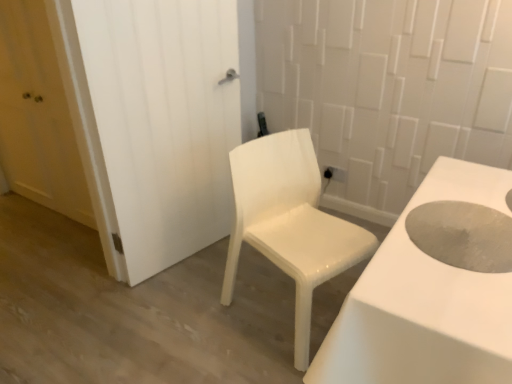
Question: Is matte white door at left, which ranks as the 1th door in left-to-right order, not inside white glossy chair at center?

Choices:
 (A) no
 (B) yes

Answer: (B)

Question: Would you consider matte white door at left, which ranks as the 1th door in left-to-right order, to be distant from white glossy chair at center?

Choices:
 (A) yes
 (B) no

Answer: (A)

Question: Can you confirm if matte white door at left, which ranks as the 1th door in left-to-right order, is wider than white glossy chair at center?

Choices:
 (A) yes
 (B) no

Answer: (B)

Question: Is white glossy chair at center at the back of matte white door at left, which ranks as the 1th door in left-to-right order?

Choices:
 (A) no
 (B) yes

Answer: (A)

Question: Considering the relative sizes of matte white door at left, which ranks as the 2th door in right-to-left order, and white glossy chair at center in the image provided, is matte white door at left, which ranks as the 2th door in right-to-left order, taller than white glossy chair at center?

Choices:
 (A) yes
 (B) no

Answer: (A)

Question: In the image, is gray matte hole at center right positioned in front of or behind white glossy chair at center?

Choices:
 (A) front
 (B) behind

Answer: (A)

Question: Is gray matte hole at center right wider or thinner than white glossy chair at center?

Choices:
 (A) wide
 (B) thin

Answer: (B)

Question: From a real-world perspective, is gray matte hole at center right above or below white glossy chair at center?

Choices:
 (A) below
 (B) above

Answer: (B)

Question: From the image's perspective, is gray matte hole at center right positioned above or below white glossy chair at center?

Choices:
 (A) above
 (B) below

Answer: (A)

Question: From the image's perspective, relative to gray matte hole at center right, is white matte door at center, marked as the second door in a left-to-right arrangement, above or below?

Choices:
 (A) below
 (B) above

Answer: (B)

Question: From a real-world perspective, is white matte door at center, which is the 1th door from right to left, positioned above or below gray matte hole at center right?

Choices:
 (A) above
 (B) below

Answer: (B)

Question: Does point (196, 87) appear closer or farther from the camera than point (505, 225)?

Choices:
 (A) closer
 (B) farther

Answer: (B)

Question: Is white matte door at center, marked as the second door in a left-to-right arrangement, in front of or behind gray matte hole at center right in the image?

Choices:
 (A) behind
 (B) front

Answer: (A)

Question: From a real-world perspective, relative to matte white door at left, which ranks as the 1th door in left-to-right order, is white glossy chair at center vertically above or below?

Choices:
 (A) below
 (B) above

Answer: (A)

Question: From their relative heights in the image, would you say white glossy chair at center is taller or shorter than matte white door at left, which ranks as the 1th door in left-to-right order?

Choices:
 (A) tall
 (B) short

Answer: (B)